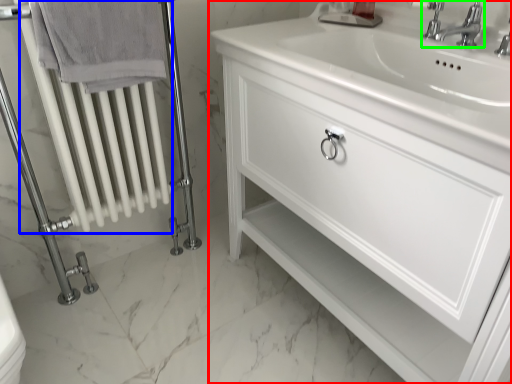
Question: Based on their relative distances, which object is farther from bathroom cabinet (highlighted by a red box)? Choose from radiator (highlighted by a blue box) and tap (highlighted by a green box).

Choices:
 (A) radiator
 (B) tap

Answer: (A)